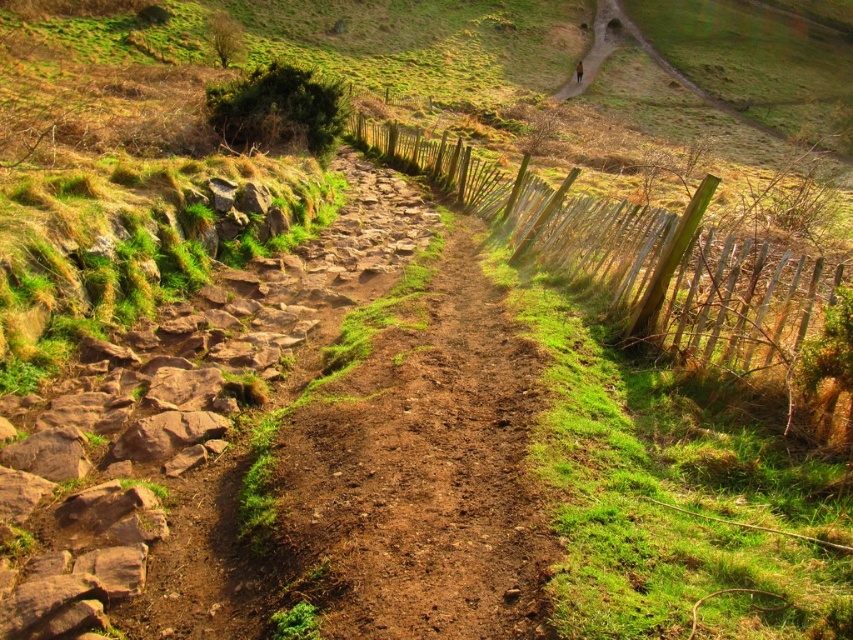
You are standing at the point labeled as point (x=409, y=465) in the image. What is the immediate terrain you are standing on?

The immediate terrain you are standing on is the brown dirt track at center.

Consider the image. You are standing at the starting point of your journey and see the brown dirt track at center. Based on its 2D coordinates, is it located closer to the top or bottom of the image?

The brown dirt track at center is located at point (409,465) in 2D coordinates. Since the y coordinate is 0.481, which is closer to 0.5, it is near the center vertically. However, since the question asks whether it is closer to the top or bottom, the exact midpoint is 0.5. The y coordinate is 0.481, which is 0.019 below the center. Therefore, it is slightly closer to the bottom of the image.